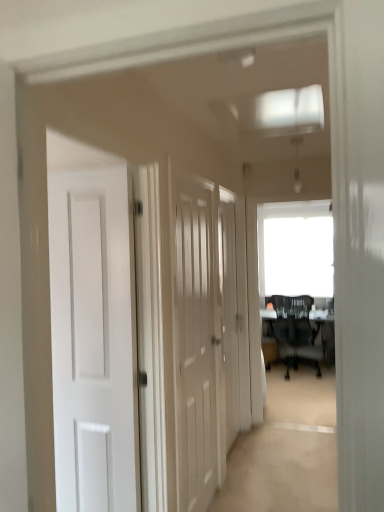
Question: Should I look upward or downward to see white wood door at center, marked as the 2th door in a front-to-back arrangement?

Choices:
 (A) down
 (B) up

Answer: (A)

Question: Is there a large distance between white wood door at center, marked as the 2th door in a left-to-right arrangement, and white wood door at center, which is counted as the 2th door, starting from the right?

Choices:
 (A) no
 (B) yes

Answer: (A)

Question: From the image's perspective, would you say white wood door at center, marked as the 2th door in a left-to-right arrangement, is positioned over white wood door at center, marked as the 1th door in a front-to-back arrangement?

Choices:
 (A) yes
 (B) no

Answer: (A)

Question: Is white wood door at center, the first door in the back-to-front sequence, oriented towards white wood door at center, marked as the 1th door in a front-to-back arrangement?

Choices:
 (A) yes
 (B) no

Answer: (B)

Question: Can you confirm if white wood door at center, marked as the 2th door in a front-to-back arrangement, is positioned to the right of white wood door at center, the 2th door from the back?

Choices:
 (A) no
 (B) yes

Answer: (B)

Question: Does white wood door at center, marked as the 2th door in a front-to-back arrangement, have a lesser width compared to white wood door at center, the 1th door viewed from the left?

Choices:
 (A) no
 (B) yes

Answer: (B)

Question: Does white wood door at center, marked as the 2th door in a front-to-back arrangement, contain white wood door at center, the 1th door viewed from the left?

Choices:
 (A) no
 (B) yes

Answer: (A)

Question: Is white wood door at center, which is the first door in right-to-left order, to the right of black mesh chair at center from the viewer's perspective?

Choices:
 (A) yes
 (B) no

Answer: (B)

Question: Can you confirm if white wood door at center, which is the first door in right-to-left order, is smaller than black mesh chair at center?

Choices:
 (A) no
 (B) yes

Answer: (B)

Question: Is white wood door at center, the first door in the back-to-front sequence, wider than black mesh chair at center?

Choices:
 (A) yes
 (B) no

Answer: (B)

Question: Is black mesh chair at center at the back of white wood door at center, marked as the 2th door in a front-to-back arrangement?

Choices:
 (A) no
 (B) yes

Answer: (A)

Question: From a real-world perspective, is white wood door at center, which is the first door in right-to-left order, on top of black mesh chair at center?

Choices:
 (A) yes
 (B) no

Answer: (A)

Question: Is white wood door at center, which is the first door in right-to-left order, thinner than black mesh chair at center?

Choices:
 (A) no
 (B) yes

Answer: (B)

Question: Is black mesh chair at center taller than white wood door at center, which is counted as the 2th door, starting from the right?

Choices:
 (A) no
 (B) yes

Answer: (A)